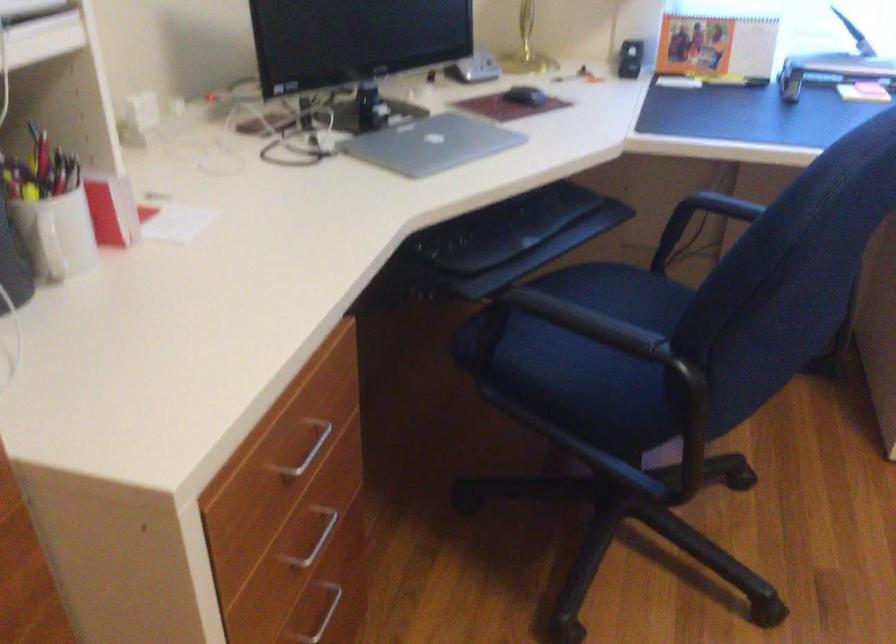
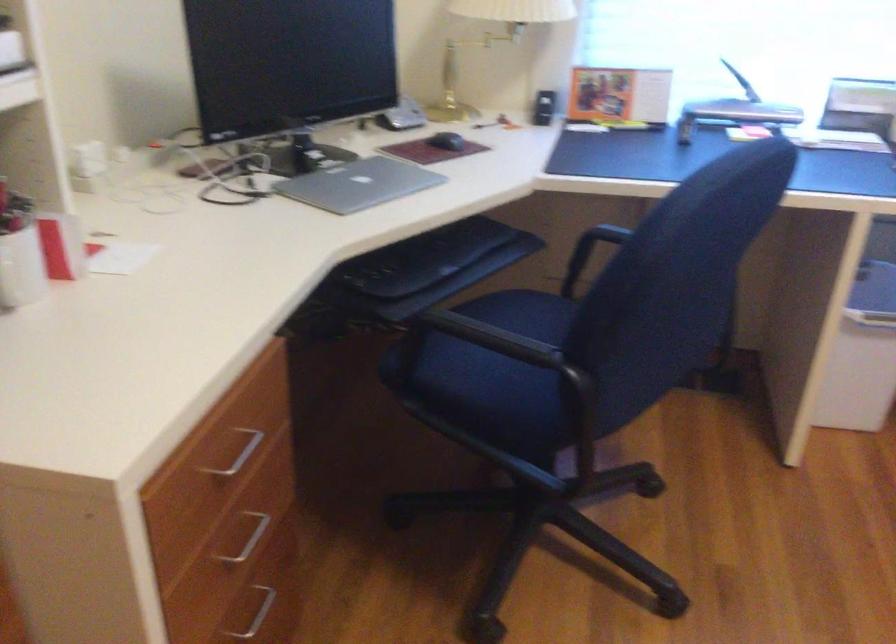
In the second image, find the point that corresponds to (566,339) in the first image.

(484, 359)